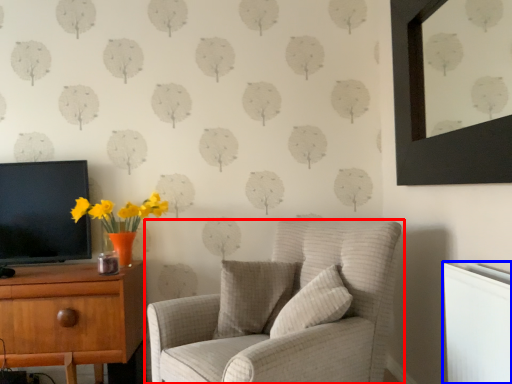
Question: Which point is closer to the camera, chair (highlighted by a red box) or radiator (highlighted by a blue box)?

Choices:
 (A) chair
 (B) radiator

Answer: (B)